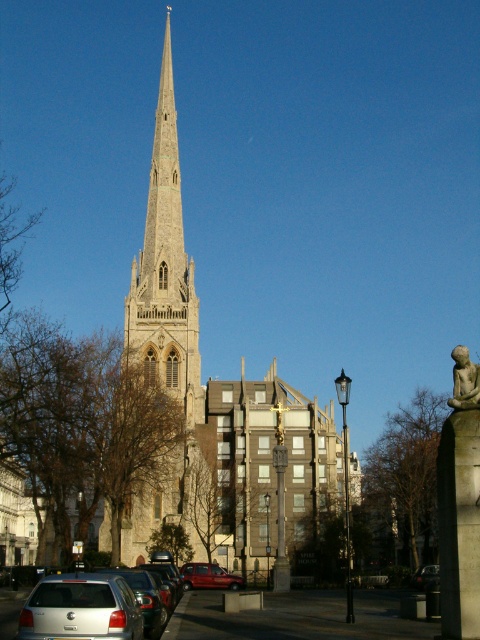
Is silver metallic car at lower left further to camera compared to silver metallic hatchback at lower left?

That is True.

Does silver metallic car at lower left have a smaller size compared to silver metallic hatchback at lower left?

Actually, silver metallic car at lower left might be larger than silver metallic hatchback at lower left.

Does point (70, 584) come farther from viewer compared to point (28, 620)?

That is True.

Identify the location of silver metallic car at lower left. The height and width of the screenshot is (640, 480). (87, 605).

Is light gray stone spire at center-left closer to the viewer compared to silver metallic car at lower left?

No, light gray stone spire at center-left is behind silver metallic car at lower left.

Is light gray stone spire at center-left bigger than silver metallic car at lower left?

Yes.

Between point (133, 314) and point (66, 621), which one is positioned in front?

Point (66, 621) is more forward.

Locate an element on the screen. light gray stone spire at center-left is located at coordinates 165,336.

Does silver metallic car at lower left have a lesser height compared to metallic red car at lower center?

No, silver metallic car at lower left is not shorter than metallic red car at lower center.

Does silver metallic car at lower left have a larger size compared to metallic red car at lower center?

Indeed, silver metallic car at lower left has a larger size compared to metallic red car at lower center.

Locate an element on the screen. The image size is (480, 640). silver metallic car at lower left is located at coordinates (87, 605).